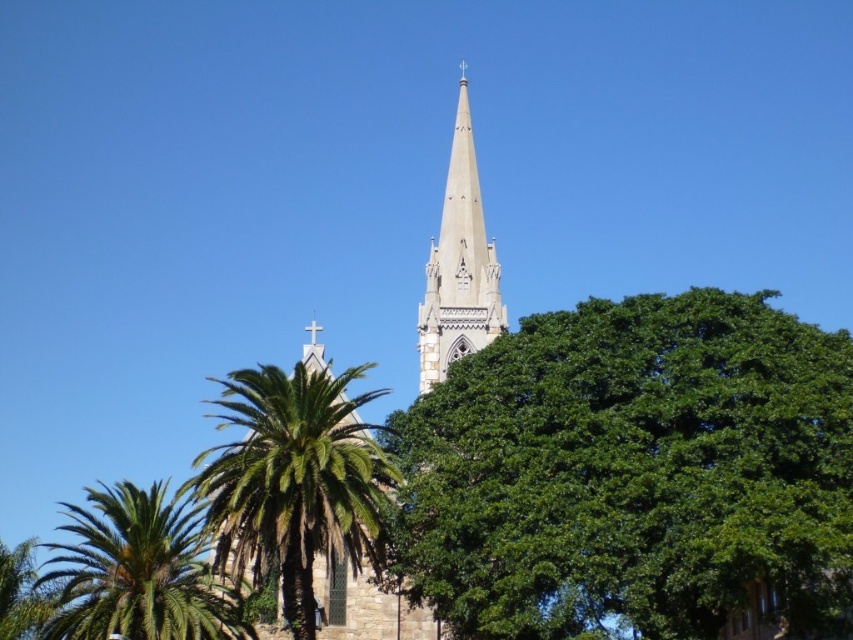
You are a photographer planning to capture the white stone church steeple at center and the green leafy palm tree at lower left in a single frame. Based on their sizes in the image, which object should you focus on to ensure it fills more of your camera view?

The white stone church steeple at center occupies more space than the green leafy palm tree at lower left, so focusing on it will fill more of the camera view.

You are standing in front of the church steeple and notice two green leafy palm trees. Which one, the green leafy palm tree at lower left or the green leafy palm tree at left, is closer to you?

The green leafy palm tree at lower left is closer because it is in front of the green leafy palm tree at left.

You are standing in front of the church and want to take a photo of the white stone church steeple at center with the green leafy palm tree at lower left in the frame. Which direction should you position the palm tree relative to the steeple in your photo?

The green leafy palm tree at lower left is already positioned to the left of the white stone church steeple at center, so you should keep the palm tree on the left side of the steeple in your photo.